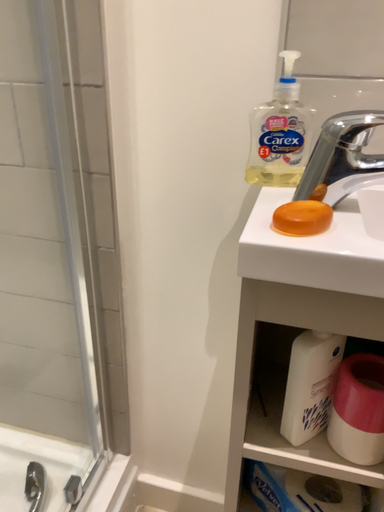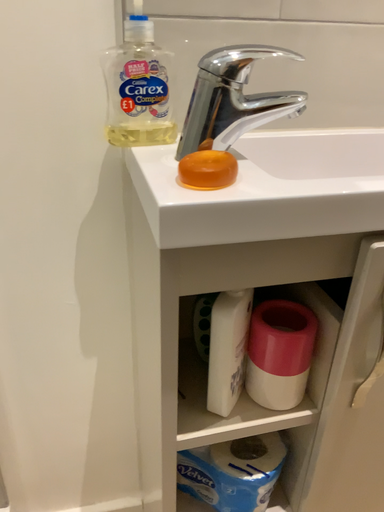
Question: How did the camera likely rotate when shooting the video?

Choices:
 (A) rotated right
 (B) rotated left

Answer: (A)